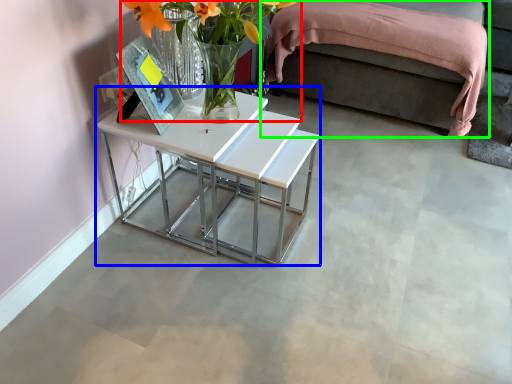
Question: Based on their relative distances, which object is nearer to floral arrangement (highlighted by a red box)? Choose from table (highlighted by a blue box) and bed (highlighted by a green box).

Choices:
 (A) table
 (B) bed

Answer: (A)